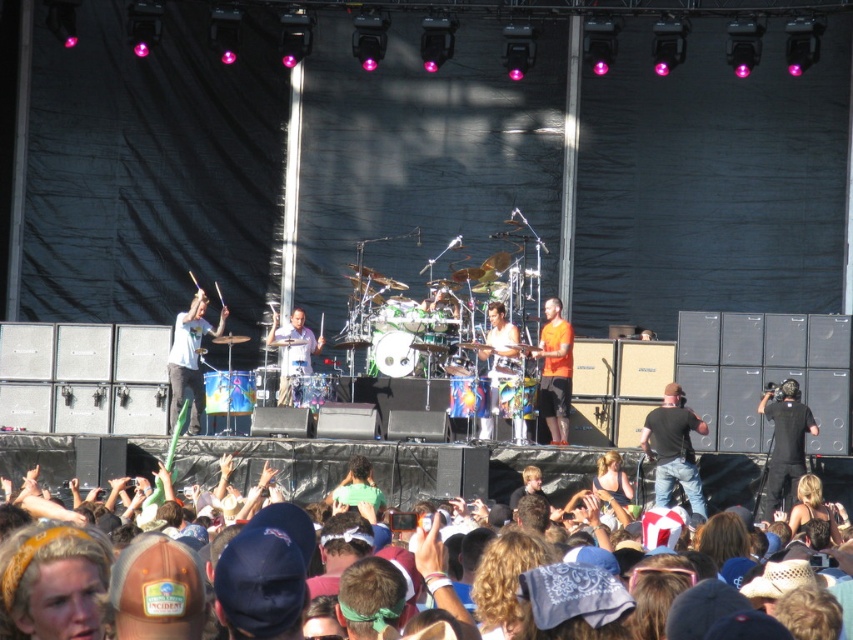
Does point (200, 291) come closer to viewer compared to point (311, 342)?

Yes, it is.

Does point (183, 362) come in front of point (289, 314)?

That is True.

You are a GUI agent. You are given a task and a screenshot of the screen. Output one action in this format:
    pyautogui.click(x=<x>, y=<y>)
    Task: Click on the white t-shirt at center
    This screenshot has width=853, height=640.
    Given the screenshot: What is the action you would take?
    pyautogui.click(x=190, y=358)

Does matte colorful drums at center have a smaller size compared to shiny metallic drum set at center?

Actually, matte colorful drums at center might be larger than shiny metallic drum set at center.

Which is behind, point (368, 280) or point (486, 355)?

The point (368, 280) is behind.

Image resolution: width=853 pixels, height=640 pixels. Describe the element at coordinates (364, 301) in the screenshot. I see `matte colorful drums at center` at that location.

In order to click on matte colorful drums at center in this screenshot , I will do `click(364, 301)`.

Which is behind, point (538, 460) or point (283, 388)?

The point (283, 388) is more distant.

Is multicolored fabric at lower center positioned at the back of matte blue drum set at center?

No, it is in front of matte blue drum set at center.

Find the location of a particular element. multicolored fabric at lower center is located at coordinates (345, 465).

The height and width of the screenshot is (640, 853). What are the coordinates of `multicolored fabric at lower center` in the screenshot? It's located at (345, 465).